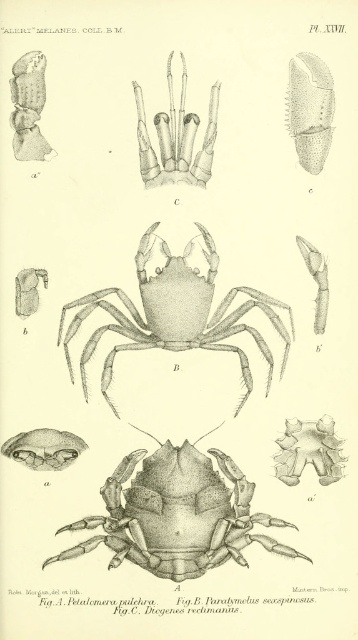
This screenshot has height=640, width=358. I want to click on grayish-brown textured crab at center, so click(308, 451).

Which is below, grayish-brown textured crab at center or matte gray insect at upper left?

grayish-brown textured crab at center is lower down.

Locate an element on the screen. Image resolution: width=358 pixels, height=640 pixels. grayish-brown textured crab at center is located at coordinates (308, 451).

Based on the photo, does gray dotted crab at center have a greater width compared to smooth gray claw at center?

Indeed, gray dotted crab at center has a greater width compared to smooth gray claw at center.

This screenshot has width=358, height=640. I want to click on gray dotted crab at center, so click(175, 314).

From the picture: Can you confirm if gray dotted crab at center is bigger than matte gray insect at upper left?

Correct, gray dotted crab at center is larger in size than matte gray insect at upper left.

I want to click on gray dotted crab at center, so click(x=175, y=314).

Find the location of a particular element. The height and width of the screenshot is (640, 358). gray dotted crab at center is located at coordinates (175, 314).